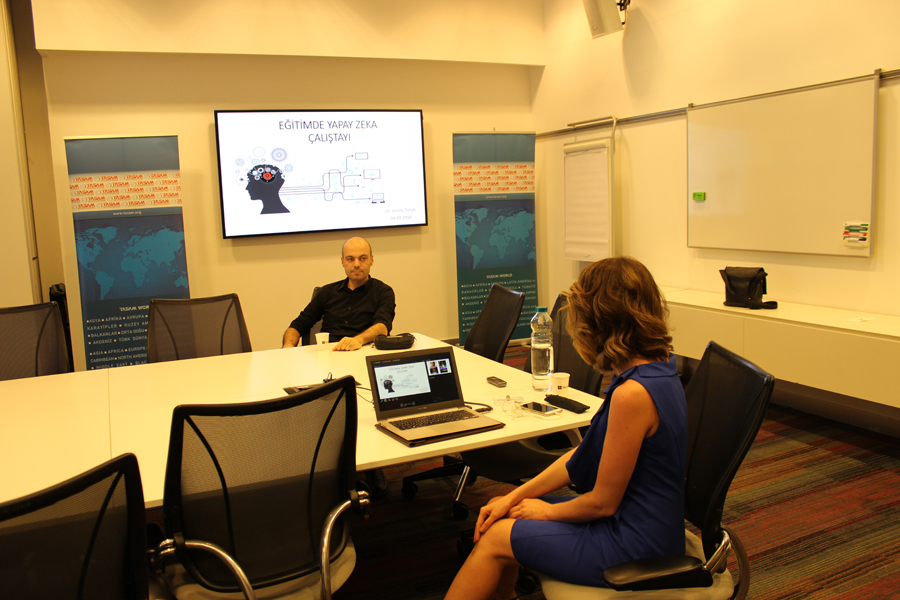
Locate an element on the screen. 2 cups is located at coordinates (321, 340), (560, 383).